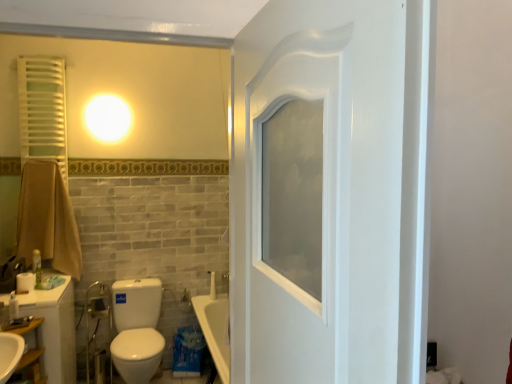
Question: Would you say green matte bottle at left is inside or outside brown cotton towel at left?

Choices:
 (A) outside
 (B) inside

Answer: (A)

Question: In terms of height, does green matte bottle at left look taller or shorter compared to brown cotton towel at left?

Choices:
 (A) tall
 (B) short

Answer: (B)

Question: Which of these objects is positioned farthest from the green matte bottle at left?

Choices:
 (A) white matte toilet paper at lower left
 (B) white matte radiator at upper left
 (C) wooden shelf at lower left
 (D) white glossy toilet at lower left
 (E) brown cotton towel at left

Answer: (B)

Question: Which of these objects is positioned farthest from the green matte bottle at left?

Choices:
 (A) wooden shelf at lower left
 (B) white glossy toilet at lower left
 (C) brown cotton towel at left
 (D) white matte toilet paper at lower left
 (E) metallic chrome faucet at lower left

Answer: (B)